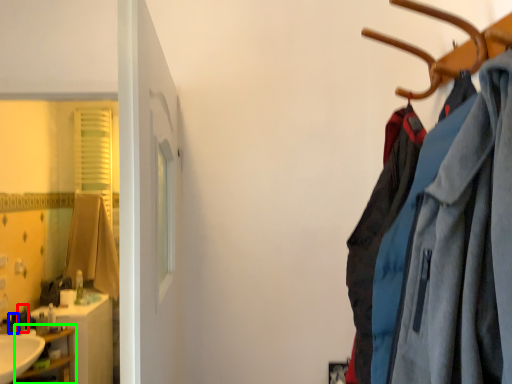
Question: Which is nearer to the toiletry (highlighted by a red box)? toiletry (highlighted by a blue box) or shelf (highlighted by a green box).

Choices:
 (A) toiletry
 (B) shelf

Answer: (A)